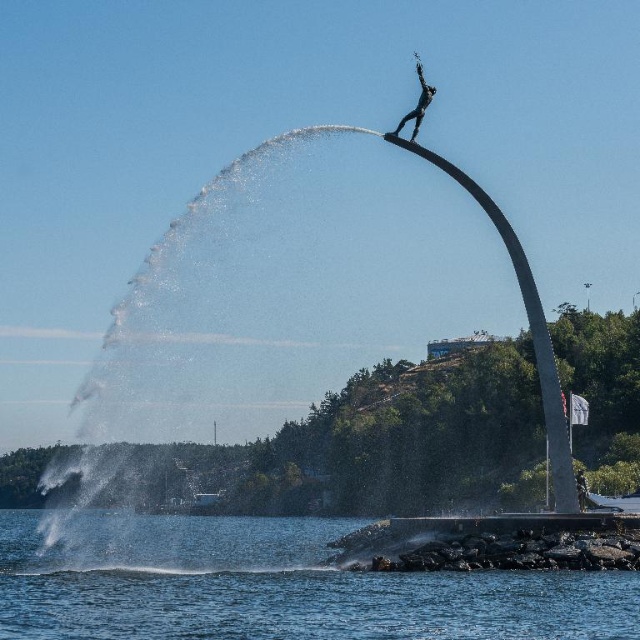
Question: Is polished bronze statue at upper center to the right of metallic silver statue at center from the viewer's perspective?

Choices:
 (A) no
 (B) yes

Answer: (A)

Question: Which object appears farthest from the camera in this image?

Choices:
 (A) clear water at lower center
 (B) metallic silver statue at center

Answer: (B)

Question: Can you confirm if clear water at lower center is positioned below metallic silver statue at center?

Choices:
 (A) no
 (B) yes

Answer: (B)

Question: Estimate the real-world distances between objects in this image. Which object is closer to the metallic silver statue at center?

Choices:
 (A) polished bronze statue at upper center
 (B) clear water at lower center

Answer: (A)

Question: Which point is farther to the camera?

Choices:
 (A) clear water at lower center
 (B) polished bronze statue at upper center
 (C) metallic silver statue at center

Answer: (C)

Question: Does clear water at lower center appear on the right side of polished bronze statue at upper center?

Choices:
 (A) no
 (B) yes

Answer: (A)